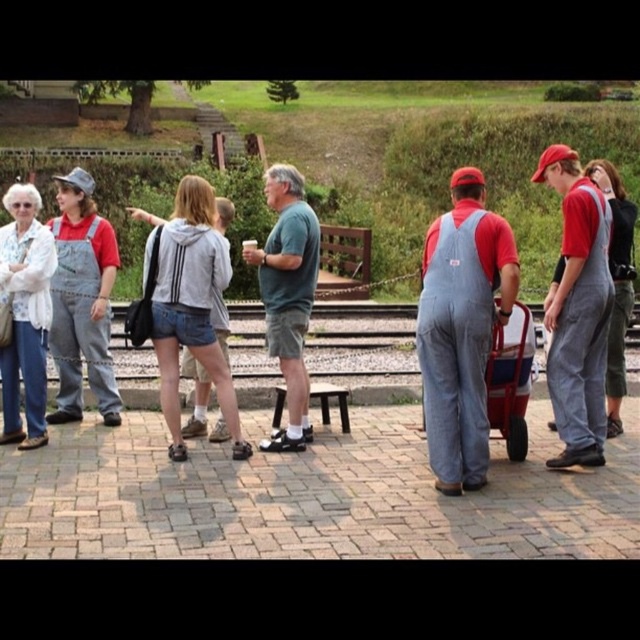
Can you confirm if gray denim overalls at right is positioned below denim shorts at center?

No.

Who is positioned more to the right, gray denim overalls at right or denim shorts at center?

gray denim overalls at right is more to the right.

Between point (573, 424) and point (216, 288), which one is positioned in front?

Point (573, 424) is more forward.

Find the location of a particular element. This screenshot has height=640, width=640. gray denim overalls at right is located at coordinates (577, 310).

Is denim overalls at center further to camera compared to metallic red cart at center?

No, denim overalls at center is in front of metallic red cart at center.

Is point (465, 296) closer to camera compared to point (515, 392)?

That is True.

Measure the distance between denim overalls at center and camera.

They are 6.49 meters apart.

This screenshot has width=640, height=640. Find the location of `denim overalls at center`. denim overalls at center is located at coordinates point(461,328).

Does denim shorts at center have a lesser width compared to green cotton shirt at center?

Indeed, denim shorts at center has a lesser width compared to green cotton shirt at center.

Can you confirm if denim shorts at center is taller than green cotton shirt at center?

Yes.

At what (x,y) coordinates should I click in order to perform the action: click on denim shorts at center. Please return your answer as a coordinate pair (x, y). Looking at the image, I should click on (189, 305).